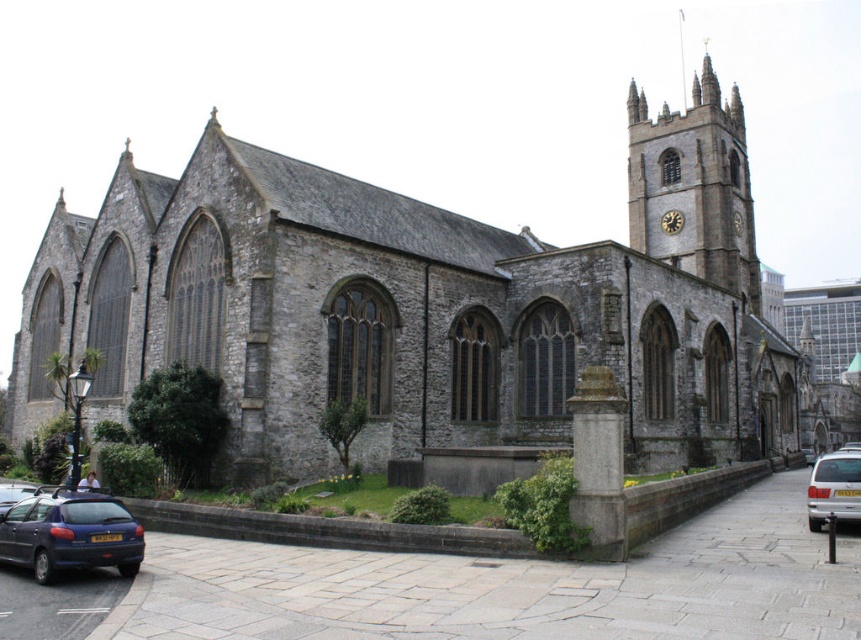
You are an architect planning to add a new spire to the stone clock tower at upper right so that it surpasses the height of the gray stone church at center. Based on the current heights, is this achievable?

The gray stone church at center is currently taller than the stone clock tower at upper right. Therefore, adding a spire to the stone clock tower at upper right could potentially make it taller than the gray stone church at center if the spire adds enough height.

You are a photographer planning to capture the historic stone church and its surroundings. You notice the stone clock tower at upper right and the matte blue car at lower left in your viewfinder. Which object should you focus on if you want to highlight the larger structure in your composition?

The stone clock tower at upper right is bigger than the matte blue car at lower left, so you should focus on the stone clock tower at upper right to highlight the larger structure in your composition.

You are a photographer planning to capture the historic stone church. You have a camera with a 24mm lens that can capture a wide angle. You want to include both the stone clock tower at upper right and the matte blue car at lower left in the frame. Based on their positions and sizes, can you estimate if the 24mm lens will allow you to fit both subjects in the photo without cropping?

The stone clock tower at upper right might be wider than matte blue car at lower left, so using a 24mm lens should allow you to capture both subjects in the frame as the wide angle can accommodate their relative sizes and positions.